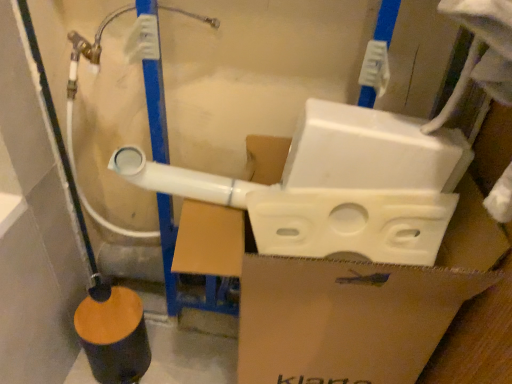
This screenshot has height=384, width=512. What do you see at coordinates (342, 298) in the screenshot?
I see `brown cardboard at center` at bounding box center [342, 298].

Locate an element on the screen. brown cardboard at center is located at coordinates (342, 298).

Where is `brown cardboard at center`? brown cardboard at center is located at coordinates (342, 298).